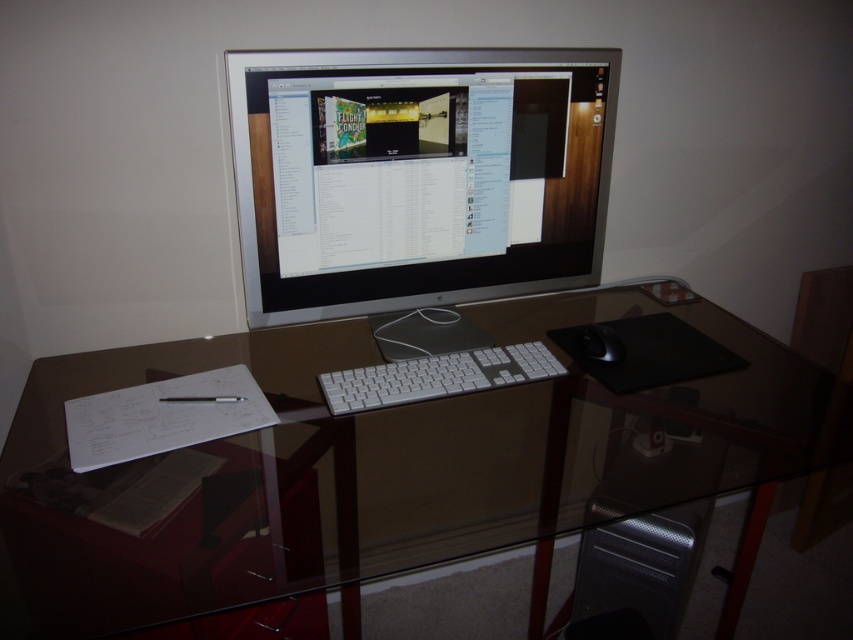
Does satin silver monitor at center have a larger size compared to silver textured computer tower at lower center?

Indeed, satin silver monitor at center has a larger size compared to silver textured computer tower at lower center.

Who is shorter, satin silver monitor at center or silver textured computer tower at lower center?

Standing shorter between the two is silver textured computer tower at lower center.

Is point (329, 220) behind point (668, 561)?

That is False.

Find the location of a particular element. This screenshot has height=640, width=853. satin silver monitor at center is located at coordinates (416, 176).

Can you confirm if transparent glass table at center is positioned to the right of white plastic keyboard at center?

Yes, transparent glass table at center is to the right of white plastic keyboard at center.

Which is behind, point (439, 524) or point (368, 397)?

Positioned behind is point (368, 397).

This screenshot has width=853, height=640. In order to click on transparent glass table at center in this screenshot , I will do `click(440, 483)`.

Consider the image. Does white plastic keyboard at center have a lesser width compared to black matte mouse at right?

No, white plastic keyboard at center is not thinner than black matte mouse at right.

Can you confirm if white plastic keyboard at center is shorter than black matte mouse at right?

No.

Does point (453, 385) lie in front of point (601, 349)?

Yes, point (453, 385) is closer to viewer.

Where is `white plastic keyboard at center`? Image resolution: width=853 pixels, height=640 pixels. white plastic keyboard at center is located at coordinates (436, 376).